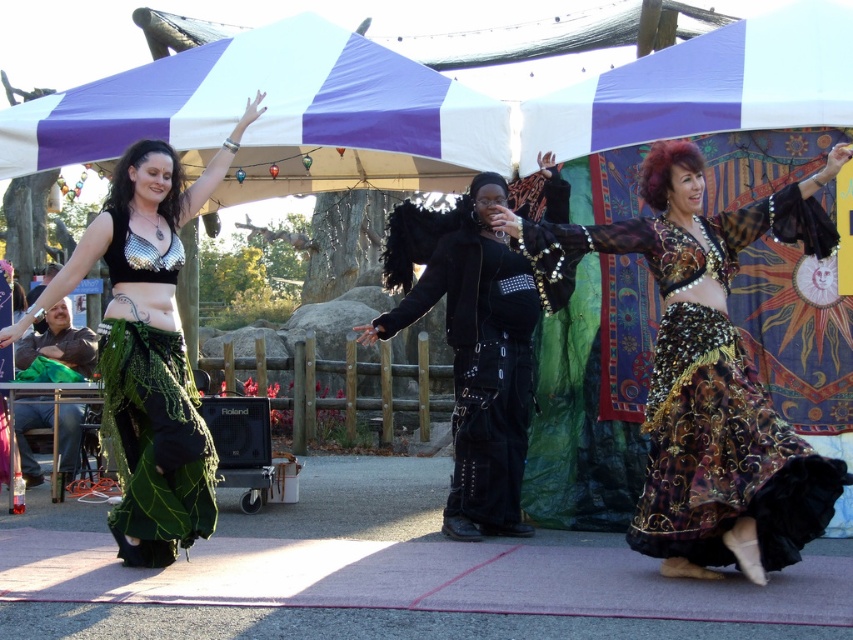
Can you confirm if metallic sequined top at center is bigger than metallic mesh bikini top at center?

Yes.

Is point (132, 403) more distant than point (126, 236)?

No, (132, 403) is in front of (126, 236).

I want to click on metallic sequined top at center, so click(148, 348).

Is gold sequined skirt at center above black leather outfit at center?

Yes, gold sequined skirt at center is above black leather outfit at center.

Which is in front, point (801, 442) or point (445, 276)?

Point (801, 442)

Identify the location of gold sequined skirt at center. coord(706,372).

Is point (387, 323) positioned in front of point (146, 253)?

That is False.

In order to click on black leather outfit at center in this screenshot , I will do `click(480, 360)`.

At what (x,y) coordinates should I click in order to perform the action: click on black leather outfit at center. Please return your answer as a coordinate pair (x, y). The image size is (853, 640). Looking at the image, I should click on (480, 360).